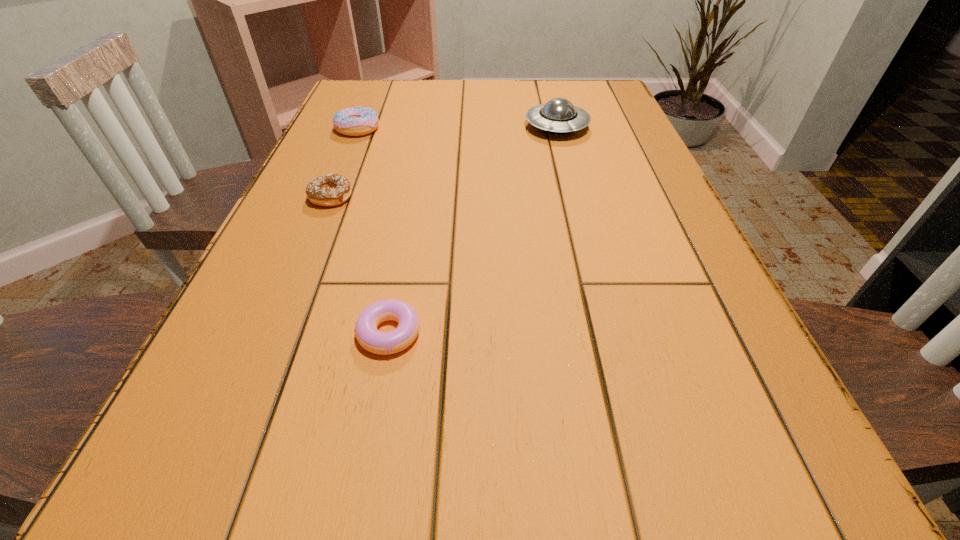
You are a GUI agent. You are given a task and a screenshot of the screen. Output one action in this format:
    pyautogui.click(x=<x>, y=<y>)
    Task: Click on the saucer
    The width and height of the screenshot is (960, 540).
    Given the screenshot: What is the action you would take?
    pyautogui.click(x=558, y=116)

Image resolution: width=960 pixels, height=540 pixels. What are the coordinates of `the tallest object` in the screenshot? It's located at (558, 116).

Where is `the farthest doughnut`? This screenshot has height=540, width=960. the farthest doughnut is located at coordinates (357, 121).

You are a GUI agent. You are given a task and a screenshot of the screen. Output one action in this format:
    pyautogui.click(x=<x>, y=<y>)
    Task: Click on the tallest doughnut
    
    Given the screenshot: What is the action you would take?
    pyautogui.click(x=357, y=121)

Locate an element on the screen. This screenshot has width=960, height=540. the second farthest doughnut is located at coordinates (333, 189).

Where is `the nearest doughnut`? This screenshot has width=960, height=540. the nearest doughnut is located at coordinates (383, 343).

At what (x,y) coordinates should I click in order to perform the action: click on the shortest doughnut. Please return your answer as a coordinate pair (x, y). Looking at the image, I should click on (383, 343).

Locate an element on the screen. vacant space located on the left of the saucer is located at coordinates (420, 127).

Locate an element on the screen. Image resolution: width=960 pixels, height=540 pixels. vacant space located 0.400m on the front of the tallest doughnut is located at coordinates [x=309, y=245].

I want to click on free space located 0.150m on the front of the second farthest doughnut, so click(x=305, y=261).